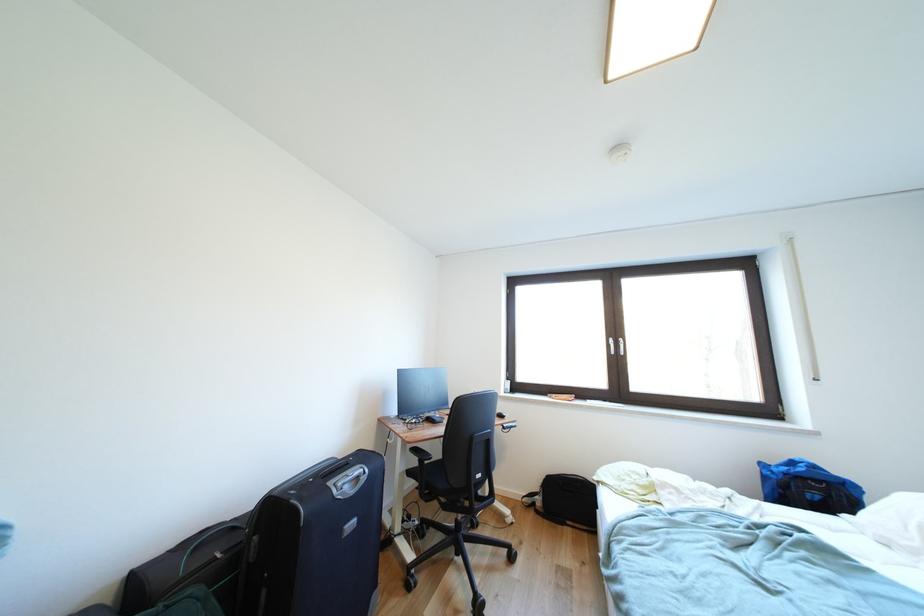
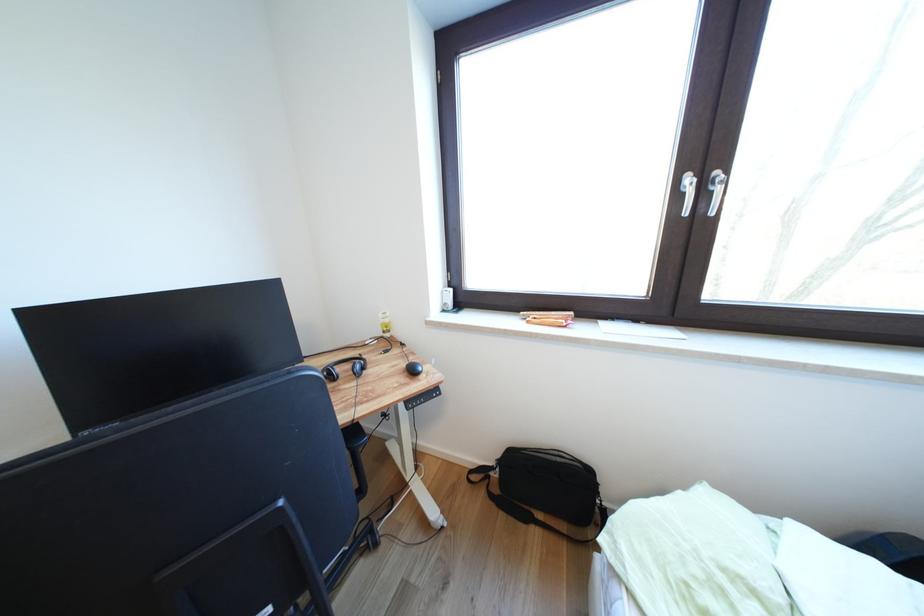
Based on the photo, in a continuous first-person perspective shot, in which direction is the camera moving?

The cameraman walked toward right, forward.